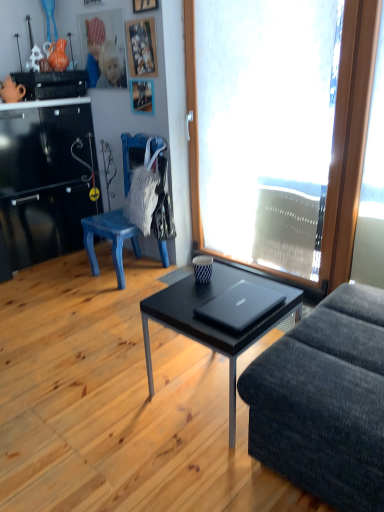
At what (x,y) coordinates should I click in order to perform the action: click on free region on the left part of black matte laptop at center. Please return your answer as a coordinate pair (x, y). Image resolution: width=384 pixels, height=512 pixels. Looking at the image, I should click on (196, 305).